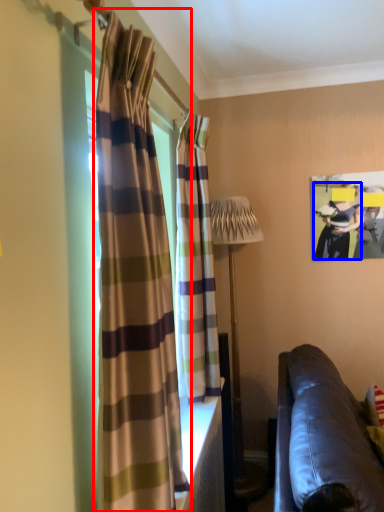
Question: Which object is closer to the camera taking this photo, curtain (highlighted by a red box) or person (highlighted by a blue box)?

Choices:
 (A) curtain
 (B) person

Answer: (A)